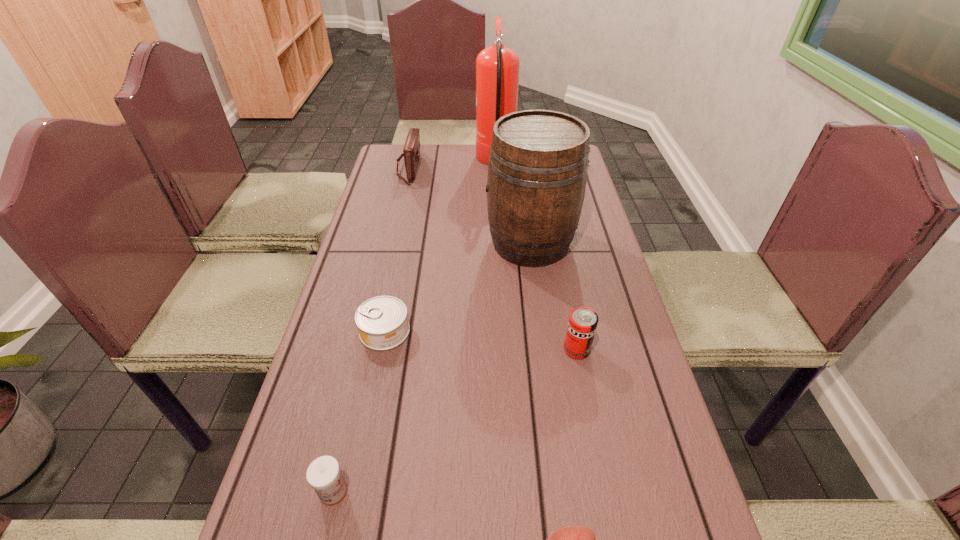
Identify the location of vacant region that satisfies the following two spatial constraints: 1. on the front flap of the taller can; 2. on the right side of the shoulder bag. (367, 349).

Find the location of a particular element. vacant point that satisfies the following two spatial constraints: 1. on the front flap of the shoulder bag; 2. on the right side of the shorter can is located at coordinates (371, 331).